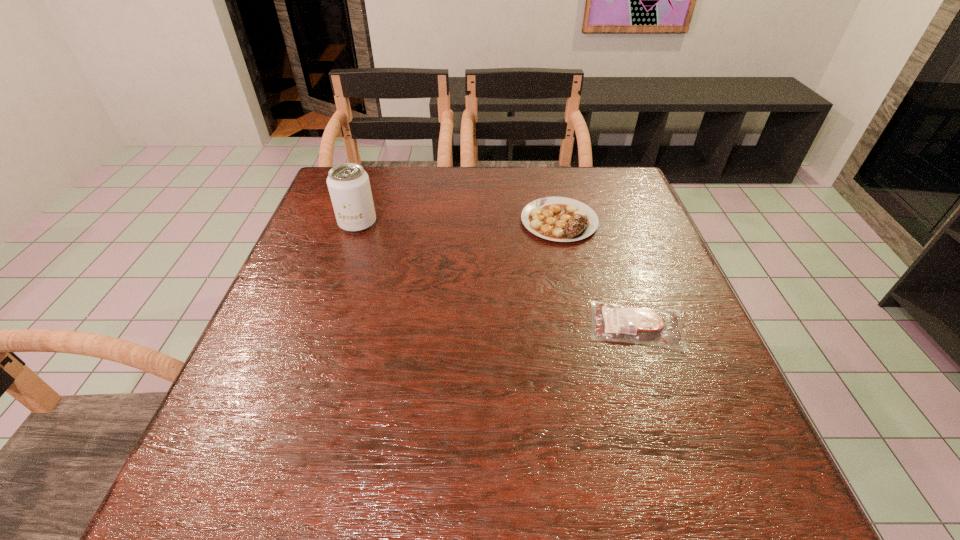
Identify the location of object located in the left edge section of the desktop. (348, 183).

Where is `object that is positioned at the far right corner`? This screenshot has height=540, width=960. object that is positioned at the far right corner is located at coordinates (561, 219).

Where is `vacant space at the far edge`? The width and height of the screenshot is (960, 540). vacant space at the far edge is located at coordinates (391, 204).

This screenshot has width=960, height=540. In order to click on vacant space at the near edge of the desktop in this screenshot , I will do `click(566, 479)`.

Find the location of a particular element. free region at the left edge is located at coordinates (244, 365).

The image size is (960, 540). I want to click on vacant space at the right edge of the desktop, so click(x=627, y=269).

In the image, there is a desktop. Identify the location of vacant space at the near left corner. This screenshot has height=540, width=960. (x=214, y=468).

In order to click on free space at the far right corner in this screenshot , I will do `click(604, 194)`.

Where is `free space between the shortest object and the soda can`? The width and height of the screenshot is (960, 540). free space between the shortest object and the soda can is located at coordinates (497, 274).

I want to click on free space between the leftmost object and the farther steak, so click(x=458, y=222).